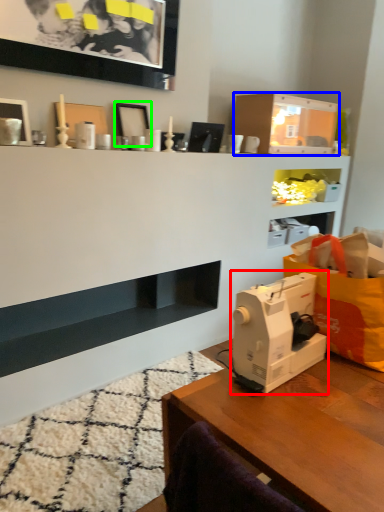
Question: Considering the real-world distances, which object is farthest from sewing machine (highlighted by a red box)? shelf (highlighted by a blue box) or picture frame (highlighted by a green box)?

Choices:
 (A) shelf
 (B) picture frame

Answer: (A)